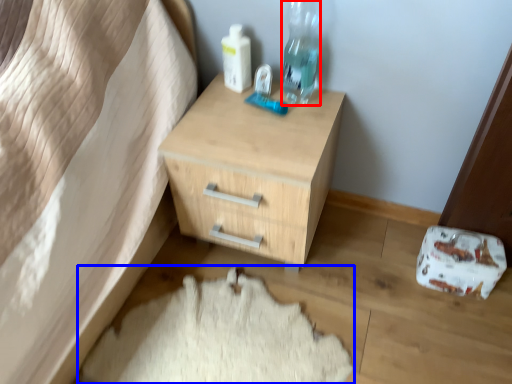
Question: Among these objects, which one is farthest to the camera, bottle (highlighted by a red box) or sheet (highlighted by a blue box)?

Choices:
 (A) bottle
 (B) sheet

Answer: (A)